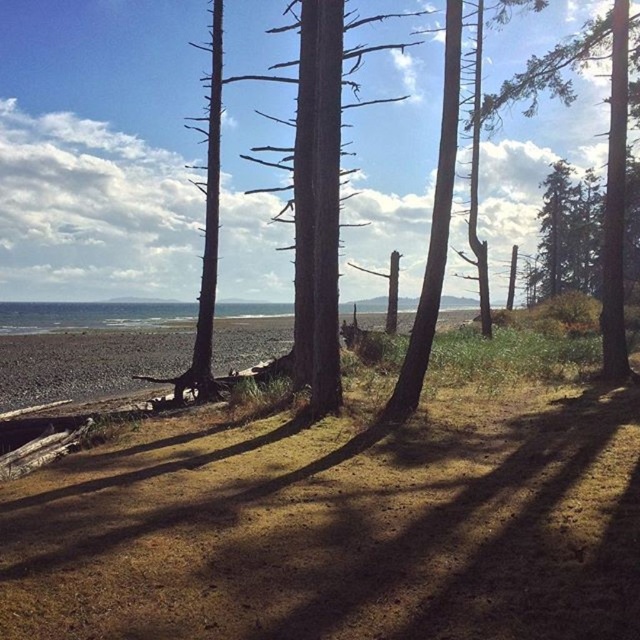
Looking at this image, you are standing at the center of the image and want to walk to the brown sandy beach at lower left. According to the coordinates provided, in which direction should you head?

The brown sandy beach at lower left is located at point (88, 360), which means you should head towards the lower left direction to reach it.

You are standing at the edge of the brown sandy beach at lower left and want to walk to the green textured tree at center. Which direction should you head to reach the tree?

You should head towards the center from the brown sandy beach at lower left to reach the green textured tree at center since the tree is located at the center of the image relative to the beach.

You are standing on the brown sandy beach at lower left and want to reach the green textured tree at center. Which direction should you move to get there?

You should move to the right because the brown sandy beach at lower left is to the left of the green textured tree at center.